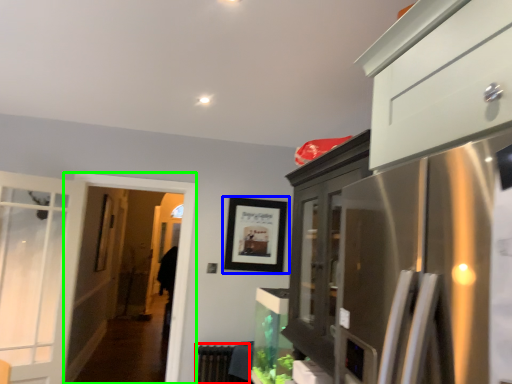
Question: Estimate the real-world distances between objects in this image. Which object is farther from radiator (highlighted by a red box), picture frame (highlighted by a blue box) or screen door (highlighted by a green box)?

Choices:
 (A) picture frame
 (B) screen door

Answer: (A)